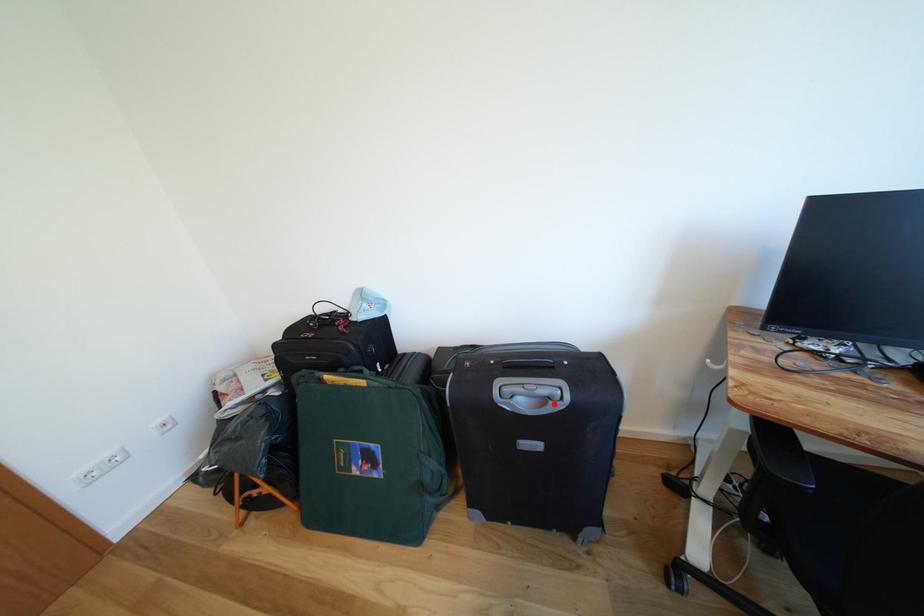
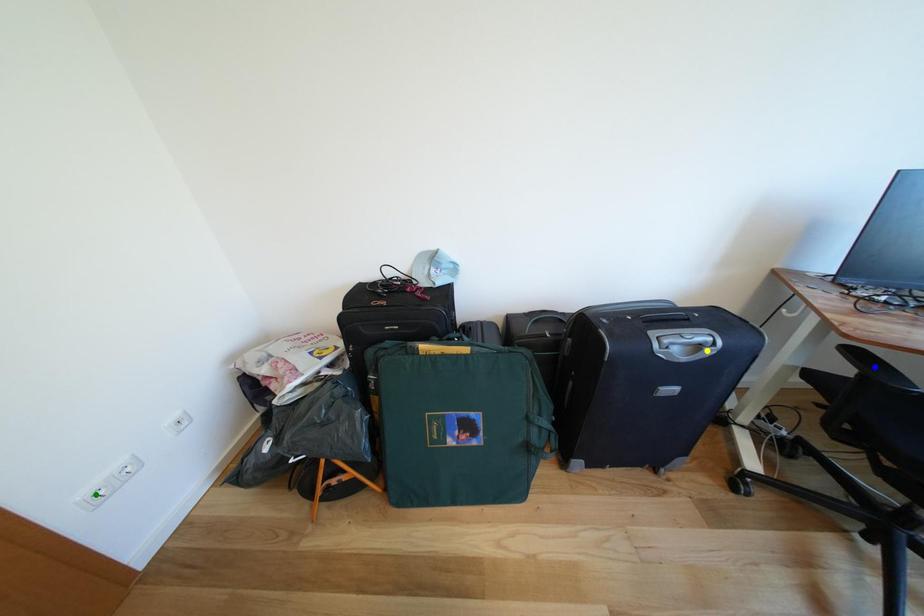
Question: I am providing you with two images of the same scene from different viewpoints. A red point is marked on the first image. You are given multiple points on the second image. Which point in image 2 represents the same 3d spot as the red point in image 1?

Choices:
 (A) yellow point
 (B) blue point
 (C) green point

Answer: (A)